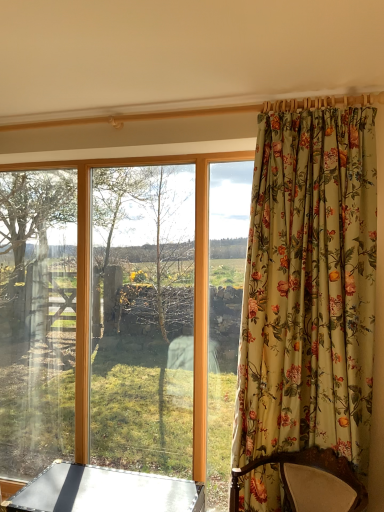
I want to click on floral fabric curtain at right, so click(x=309, y=288).

What is the approximate height of transparent glass window at center?

transparent glass window at center is 7.12 feet tall.

This screenshot has height=512, width=384. Find the location of `floral fabric curtain at right`. floral fabric curtain at right is located at coordinates (309, 288).

Considering the relative positions of transparent glass window at center and velvet upholstered chair at right in the image provided, is transparent glass window at center in front of velvet upholstered chair at right?

No, transparent glass window at center is further to the viewer.

Is transparent glass window at center positioned far away from velvet upholstered chair at right?

No, there isn't a large distance between transparent glass window at center and velvet upholstered chair at right.

Does transparent glass window at center have a greater width compared to velvet upholstered chair at right?

Incorrect, the width of transparent glass window at center does not surpass that of velvet upholstered chair at right.

What's the angular difference between transparent glass window at center and velvet upholstered chair at right's facing directions?

23.3 degrees separate the facing orientations of transparent glass window at center and velvet upholstered chair at right.

Is transparent glass window at center surrounded by metallic silver table at lower left?

No.

Can you confirm if metallic silver table at lower left is thinner than transparent glass window at center?

Incorrect, the width of metallic silver table at lower left is not less than that of transparent glass window at center.

Is metallic silver table at lower left aimed at transparent glass window at center?

No, metallic silver table at lower left is not oriented towards transparent glass window at center.

How many degrees apart are the facing directions of metallic silver table at lower left and transparent glass window at center?

The angular difference between metallic silver table at lower left and transparent glass window at center is 0.708 degrees.

Is floral fabric curtain at right far away from transparent glass window at center?

No, there isn't a large distance between floral fabric curtain at right and transparent glass window at center.

Considering the sizes of floral fabric curtain at right and transparent glass window at center in the image, is floral fabric curtain at right taller or shorter than transparent glass window at center?

floral fabric curtain at right is shorter than transparent glass window at center.

Is the position of floral fabric curtain at right less distant than that of transparent glass window at center?

Yes, floral fabric curtain at right is in front of transparent glass window at center.

Is floral fabric curtain at right positioned with its back to transparent glass window at center?

That's not correct — floral fabric curtain at right is not looking away from transparent glass window at center.

In terms of width, does transparent glass window at center look wider or thinner when compared to floral fabric curtain at right?

In the image, transparent glass window at center appears to be more narrow than floral fabric curtain at right.

From a real-world perspective, who is located higher, transparent glass window at center or floral fabric curtain at right?

floral fabric curtain at right is physically above.

Is transparent glass window at center in front of or behind floral fabric curtain at right in the image?

transparent glass window at center is positioned farther from the viewer than floral fabric curtain at right.

Is transparent glass window at center in contact with floral fabric curtain at right?

transparent glass window at center and floral fabric curtain at right are not in contact.

Does point (154, 503) lie behind point (317, 462)?

Yes, point (154, 503) is behind point (317, 462).

Which of these two, metallic silver table at lower left or velvet upholstered chair at right, is bigger?

Bigger between the two is metallic silver table at lower left.

How different are the orientations of metallic silver table at lower left and velvet upholstered chair at right in degrees?

24 degrees separate the facing orientations of metallic silver table at lower left and velvet upholstered chair at right.

Looking at this image, would you say velvet upholstered chair at right is part of metallic silver table at lower left's contents?

Actually, velvet upholstered chair at right is outside metallic silver table at lower left.

Considering the relative sizes of transparent glass window at center and metallic silver table at lower left in the image provided, is transparent glass window at center thinner than metallic silver table at lower left?

Indeed, transparent glass window at center has a lesser width compared to metallic silver table at lower left.

Is transparent glass window at center surrounding metallic silver table at lower left?

That's incorrect, metallic silver table at lower left is not inside transparent glass window at center.

From the image's perspective, is transparent glass window at center located above metallic silver table at lower left?

Yes.

From the picture: Which is correct: velvet upholstered chair at right is inside metallic silver table at lower left, or outside of it?

velvet upholstered chair at right is outside metallic silver table at lower left.

Is point (232, 469) farther from viewer compared to point (64, 502)?

No, it is in front of (64, 502).

From the image's perspective, is velvet upholstered chair at right above or below metallic silver table at lower left?

Based on their image positions, velvet upholstered chair at right is located above metallic silver table at lower left.

Looking at this image, which of these two, velvet upholstered chair at right or metallic silver table at lower left, stands shorter?

With less height is metallic silver table at lower left.

Identify the location of furniture in front of the transparent glass window at center. (310, 481).

In the image, there is a transparent glass window at center. Identify the location of table below it (from the image's perspective). The image size is (384, 512). (105, 490).

When comparing their distances from transparent glass window at center, does floral fabric curtain at right or metallic silver table at lower left seem further?

floral fabric curtain at right is positioned further to the anchor transparent glass window at center.

Estimate the real-world distances between objects in this image. Which object is further from metallic silver table at lower left, transparent glass window at center or floral fabric curtain at right?

floral fabric curtain at right is positioned further to the anchor metallic silver table at lower left.

Estimate the real-world distances between objects in this image. Which object is closer to transparent glass window at center, floral fabric curtain at right or velvet upholstered chair at right?

floral fabric curtain at right lies closer to transparent glass window at center than the other object.

Estimate the real-world distances between objects in this image. Which object is further from transparent glass window at center, metallic silver table at lower left or floral fabric curtain at right?

Based on the image, floral fabric curtain at right appears to be further to transparent glass window at center.

Which object lies nearer to the anchor point floral fabric curtain at right, velvet upholstered chair at right or metallic silver table at lower left?

Among the two, velvet upholstered chair at right is located nearer to floral fabric curtain at right.

Considering their positions, is metallic silver table at lower left positioned further to velvet upholstered chair at right than transparent glass window at center?

The object further to velvet upholstered chair at right is transparent glass window at center.

When comparing their distances from metallic silver table at lower left, does transparent glass window at center or velvet upholstered chair at right seem further?

velvet upholstered chair at right is further to metallic silver table at lower left.

Based on their spatial positions, is metallic silver table at lower left or velvet upholstered chair at right further from floral fabric curtain at right?

Among the two, metallic silver table at lower left is located further to floral fabric curtain at right.

Find the location of a particular element. This screenshot has height=512, width=384. furniture between floral fabric curtain at right and metallic silver table at lower left in the vertical direction is located at coordinates (310, 481).

Where is `window that lies between floral fabric curtain at right and metallic silver table at lower left from top to bottom`? The width and height of the screenshot is (384, 512). window that lies between floral fabric curtain at right and metallic silver table at lower left from top to bottom is located at coordinates (194, 292).

Identify the location of furniture situated between transparent glass window at center and floral fabric curtain at right from left to right. This screenshot has width=384, height=512. (310, 481).

Image resolution: width=384 pixels, height=512 pixels. In order to click on table located between transparent glass window at center and velvet upholstered chair at right in the left-right direction in this screenshot , I will do `click(105, 490)`.